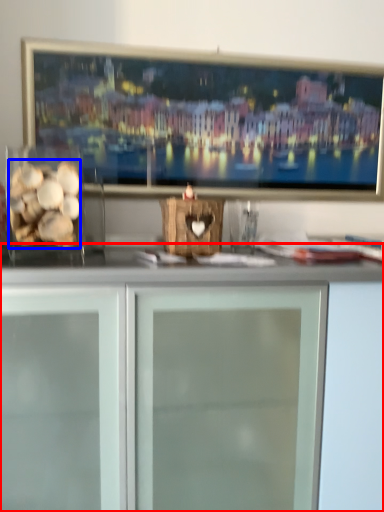
Question: Which point is closer to the camera, cabinetry (highlighted by a red box) or food (highlighted by a blue box)?

Choices:
 (A) cabinetry
 (B) food

Answer: (A)